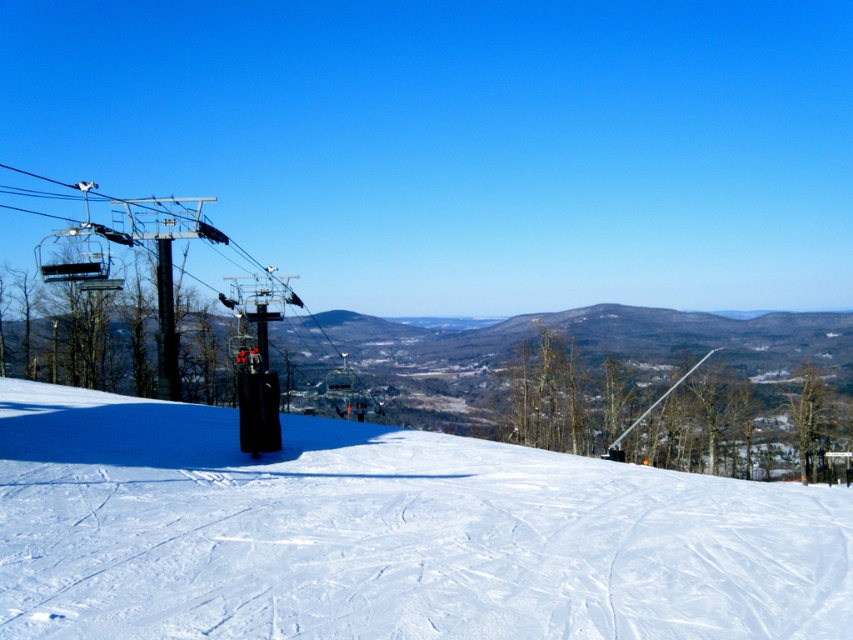
You are planning to ski down the slope and want to know if you can pass through the area between the white powdery snow at center and the metallic gray ski lift at left. Given that your skis are 1 meter wide, can you fit through the space between them?

The white powdery snow at center has a lesser width compared to metallic gray ski lift at left, meaning the space between them is narrower than the ski lift. Since your skis are 1 meter wide, you need to check if the width of the white powdery snow at center allows passage. However, the description only states the snow is narrower than the ski lift, not the exact width. Without knowing the exact dimensions, it is uncertain if the 1 meter ski width will fit. Please verify the actual width before attempting.

You are a skier planning your descent down the slope. You see the white powdery snow at center and the metallic gray ski lift at left. Which object is lower in the scene?

The white powdery snow at center is below the metallic gray ski lift at left, so it is lower in the scene.